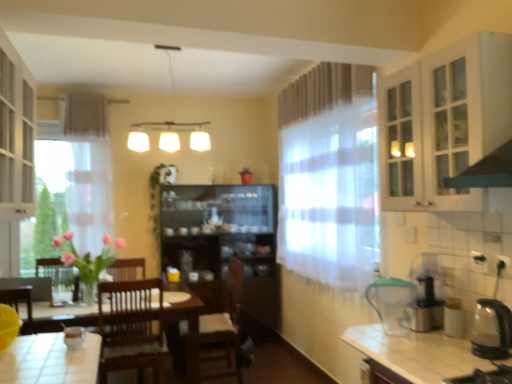
Question: Considering the positions of point (461, 112) and point (500, 327), is point (461, 112) closer or farther from the camera than point (500, 327)?

Choices:
 (A) farther
 (B) closer

Answer: (B)

Question: In the image, is white glass cabinet at upper right, the 1th cabinetry viewed from the right, positioned in front of or behind transparent glass kettle at right, placed as the first appliance when sorted from right to left?

Choices:
 (A) behind
 (B) front

Answer: (B)

Question: Estimate the real-world distances between objects in this image. Which object is closer to the white glass cabinet at left, arranged as the first cabinetry when viewed from the left?

Choices:
 (A) green rubber hose at lower right, the 1th appliance positioned from the left
 (B) white matte light fixture at upper center
 (C) white glossy table at lower left
 (D) translucent fabric curtain at center
 (E) transparent glass kettle at right, placed as the first appliance when sorted from right to left

Answer: (C)

Question: Which object is positioned farthest from the white glass cabinet at left, the 2th cabinetry ordered from the bottom?

Choices:
 (A) clear glass cabinet at upper right
 (B) black plastic coffee machine at right
 (C) white glossy table at lower left
 (D) brown wooden chair at center
 (E) transparent glass kettle at right, placed as the first appliance when sorted from right to left

Answer: (E)